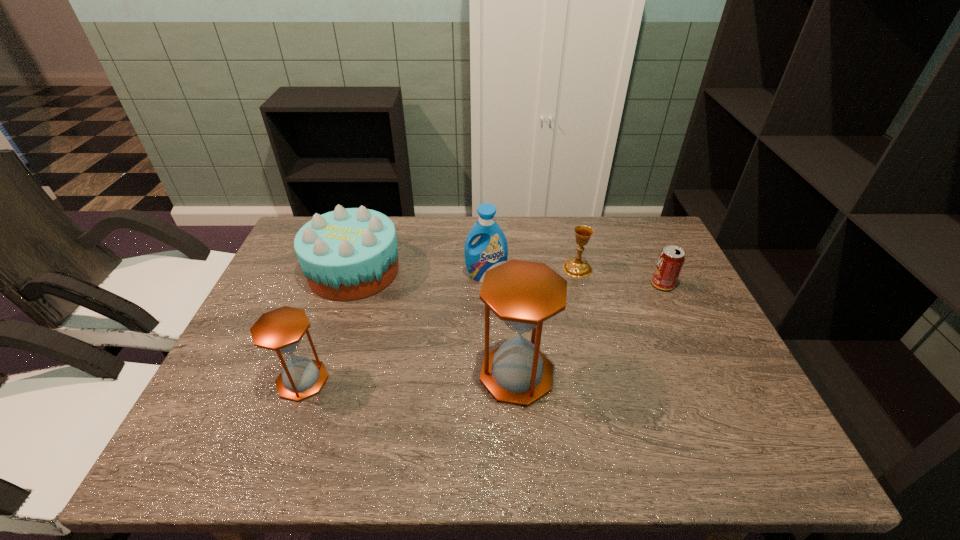
Where is `vacant area that lies between the chalice and the shortest object`? Image resolution: width=960 pixels, height=540 pixels. vacant area that lies between the chalice and the shortest object is located at coordinates (620, 276).

Where is `vacant space that's between the left hourglass and the cake`? vacant space that's between the left hourglass and the cake is located at coordinates (328, 326).

At what (x,y) coordinates should I click in order to perform the action: click on free space between the shortest object and the chalice. Please return your answer as a coordinate pair (x, y). The image size is (960, 540). Looking at the image, I should click on (620, 276).

The image size is (960, 540). Find the location of `empty space between the right hourglass and the second object from right to left`. empty space between the right hourglass and the second object from right to left is located at coordinates (547, 321).

Find the location of a particular element. This screenshot has height=540, width=960. vacant space in between the taller hourglass and the second object from right to left is located at coordinates (547, 321).

Image resolution: width=960 pixels, height=540 pixels. I want to click on the fourth closest object relative to the rightmost object, so click(348, 254).

At what (x,y) coordinates should I click in order to perform the action: click on the fifth closest object to the cake. Please return your answer as a coordinate pair (x, y). Looking at the image, I should click on click(x=671, y=259).